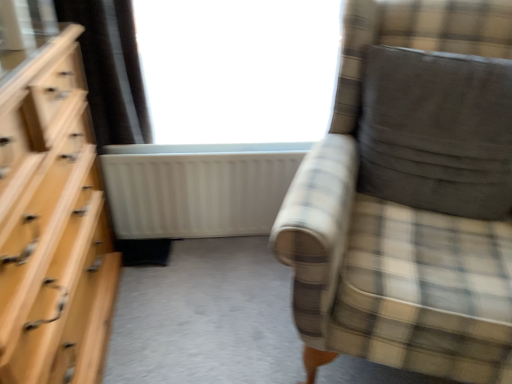
What do you see at coordinates (197, 188) in the screenshot? The height and width of the screenshot is (384, 512). I see `white matte radiator at center` at bounding box center [197, 188].

What is the approximate width of plaid fabric chair at right?

81.94 centimeters.

Find the location of `transparent glass window at upper center`. transparent glass window at upper center is located at coordinates (238, 68).

Find the location of a particular element. white matte radiator at center is located at coordinates (197, 188).

Find the location of a particular element. the chest of drawers in front of the transparent glass window at upper center is located at coordinates (52, 224).

From a real-world perspective, who is located lower, transparent glass window at upper center or light wood dresser at left?

light wood dresser at left is physically lower.

Choose the correct answer: Is transparent glass window at upper center inside light wood dresser at left or outside it?

transparent glass window at upper center is spatially situated outside light wood dresser at left.

What's the angular difference between transparent glass window at upper center and light wood dresser at left's facing directions?

The facing directions of transparent glass window at upper center and light wood dresser at left are 92.9 degrees apart.

Is transparent glass window at upper center not within white matte radiator at center?

Yes, transparent glass window at upper center is outside of white matte radiator at center.

Does point (159, 57) come behind point (202, 195)?

No, (159, 57) is closer to viewer.

Are transparent glass window at upper center and white matte radiator at center making contact?

transparent glass window at upper center is not next to white matte radiator at center, and they're not touching.

Which object is positioned more to the right, transparent glass window at upper center or white matte radiator at center?

From the viewer's perspective, transparent glass window at upper center appears more on the right side.

Is plaid fabric chair at right positioned before white matte radiator at center?

Yes, it is.

Is plaid fabric chair at right at the right side of white matte radiator at center?

Correct, you'll find plaid fabric chair at right to the right of white matte radiator at center.

How far apart are plaid fabric chair at right and white matte radiator at center?

plaid fabric chair at right and white matte radiator at center are 25.35 inches apart.

From a real-world perspective, is plaid fabric chair at right on top of white matte radiator at center?

Correct, in the physical world, plaid fabric chair at right is higher than white matte radiator at center.

Is dark gray suede pillow at right not within plaid fabric chair at right?

That's incorrect, dark gray suede pillow at right is not completely outside plaid fabric chair at right.

Between dark gray suede pillow at right and plaid fabric chair at right, which one is positioned in front?

plaid fabric chair at right is more forward.

Which is further, [484,183] or [510,314]?

Point [484,183]

What's the angular difference between dark gray suede pillow at right and plaid fabric chair at right's facing directions?

There is a 4.85-degree angle between the facing directions of dark gray suede pillow at right and plaid fabric chair at right.

From the picture: How many degrees apart are the facing directions of light wood dresser at left and dark gray suede pillow at right?

The angular difference between light wood dresser at left and dark gray suede pillow at right is 120 degrees.

Is the surface of light wood dresser at left in direct contact with dark gray suede pillow at right?

They are not placed beside each other.

From a real-world perspective, is light wood dresser at left physically located above or below dark gray suede pillow at right?

Clearly, from a real-world perspective, light wood dresser at left is below dark gray suede pillow at right.

From the image's perspective, which one is positioned higher, light wood dresser at left or dark gray suede pillow at right?

dark gray suede pillow at right is shown above in the image.

Measure the distance between transparent glass window at upper center and plaid fabric chair at right.

transparent glass window at upper center and plaid fabric chair at right are 25.35 inches apart.

At what (x,y) coordinates should I click in order to perform the action: click on window on the left of plaid fabric chair at right. Please return your answer as a coordinate pair (x, y). Looking at the image, I should click on (238, 68).

Would you consider transparent glass window at upper center to be distant from plaid fabric chair at right?

transparent glass window at upper center is actually quite close to plaid fabric chair at right.

Is transparent glass window at upper center at the left side of plaid fabric chair at right?

Correct, you'll find transparent glass window at upper center to the left of plaid fabric chair at right.

Considering the relative sizes of dark gray suede pillow at right and white matte radiator at center in the image provided, is dark gray suede pillow at right taller than white matte radiator at center?

No, dark gray suede pillow at right is not taller than white matte radiator at center.

Looking at their sizes, would you say dark gray suede pillow at right is wider or thinner than white matte radiator at center?

Clearly, dark gray suede pillow at right has more width compared to white matte radiator at center.

The width and height of the screenshot is (512, 384). I want to click on radiator below the dark gray suede pillow at right (from a real-world perspective), so coord(197,188).

From the picture: How far apart are dark gray suede pillow at right and white matte radiator at center?

A distance of 24.87 inches exists between dark gray suede pillow at right and white matte radiator at center.

You are a GUI agent. You are given a task and a screenshot of the screen. Output one action in this format:
    pyautogui.click(x=<x>, y=<y>)
    Task: Click on the chest of drawers in front of the transparent glass window at upper center
    
    Given the screenshot: What is the action you would take?
    pyautogui.click(x=52, y=224)

Where is `window that is above the white matte radiator at center (from a real-world perspective)`? window that is above the white matte radiator at center (from a real-world perspective) is located at coordinates click(238, 68).

Which object lies further to the anchor point light wood dresser at left, dark gray suede pillow at right or white matte radiator at center?

dark gray suede pillow at right lies further to light wood dresser at left than the other object.

Estimate the real-world distances between objects in this image. Which object is closer to plaid fabric chair at right, dark gray suede pillow at right or white matte radiator at center?

dark gray suede pillow at right lies closer to plaid fabric chair at right than the other object.

Which object lies nearer to the anchor point dark gray suede pillow at right, transparent glass window at upper center or light wood dresser at left?

transparent glass window at upper center.

Estimate the real-world distances between objects in this image. Which object is closer to plaid fabric chair at right, light wood dresser at left or white matte radiator at center?

The object closer to plaid fabric chair at right is white matte radiator at center.

Which object lies nearer to the anchor point light wood dresser at left, white matte radiator at center or transparent glass window at upper center?

The object closer to light wood dresser at left is white matte radiator at center.

Estimate the real-world distances between objects in this image. Which object is further from plaid fabric chair at right, dark gray suede pillow at right or light wood dresser at left?

Based on the image, light wood dresser at left appears to be further to plaid fabric chair at right.

Considering their positions, is plaid fabric chair at right positioned further to transparent glass window at upper center than light wood dresser at left?

light wood dresser at left is positioned further to the anchor transparent glass window at upper center.

Looking at the image, which one is located closer to plaid fabric chair at right, light wood dresser at left or transparent glass window at upper center?

transparent glass window at upper center lies closer to plaid fabric chair at right than the other object.

At what (x,y) coordinates should I click in order to perform the action: click on window between plaid fabric chair at right and white matte radiator at center in the front-back direction. Please return your answer as a coordinate pair (x, y). Looking at the image, I should click on (238, 68).

In order to click on pillow between light wood dresser at left and plaid fabric chair at right in the horizontal direction in this screenshot , I will do `click(437, 131)`.

You are a GUI agent. You are given a task and a screenshot of the screen. Output one action in this format:
    pyautogui.click(x=<x>, y=<y>)
    Task: Click on the chair between light wood dresser at left and white matte radiator at center in the front-back direction
    The height and width of the screenshot is (384, 512).
    Given the screenshot: What is the action you would take?
    pyautogui.click(x=398, y=226)

Find the location of `pillow between plaid fabric chair at right and white matte radiator at center along the z-axis`. pillow between plaid fabric chair at right and white matte radiator at center along the z-axis is located at coordinates (437, 131).